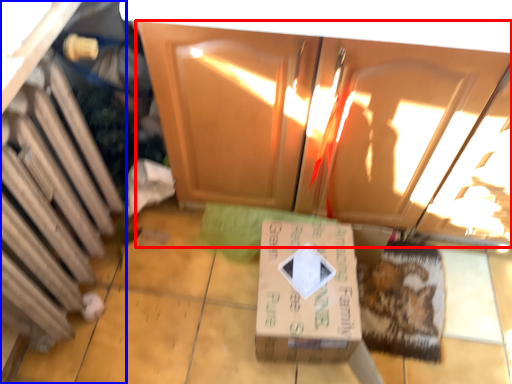
Question: Among these objects, which one is nearest to the camera, cabinetry (highlighted by a red box) or cabinetry (highlighted by a blue box)?

Choices:
 (A) cabinetry
 (B) cabinetry

Answer: (B)